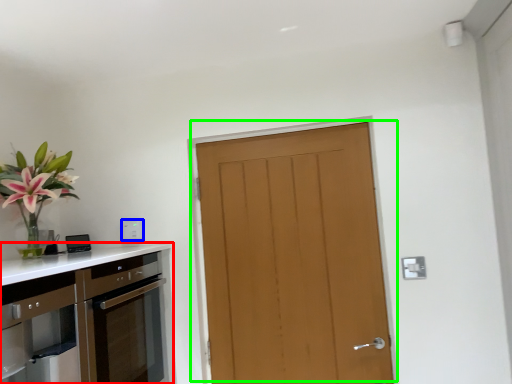
Question: Estimate the real-world distances between objects in this image. Which object is closer to cabinetry (highlighted by a red box), electric outlet (highlighted by a blue box) or door (highlighted by a green box)?

Choices:
 (A) electric outlet
 (B) door

Answer: (A)